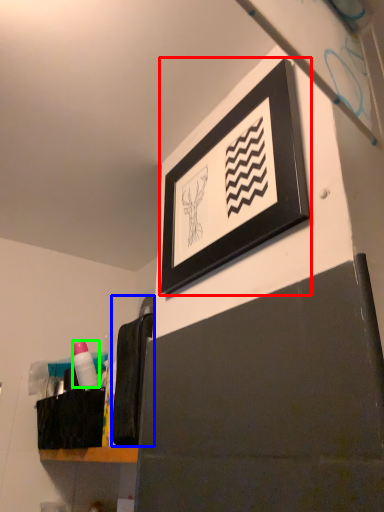
Question: Which object is positioned farthest from picture frame (highlighted by a red box)? Select from laundry (highlighted by a blue box) and toiletry (highlighted by a green box).

Choices:
 (A) laundry
 (B) toiletry

Answer: (B)